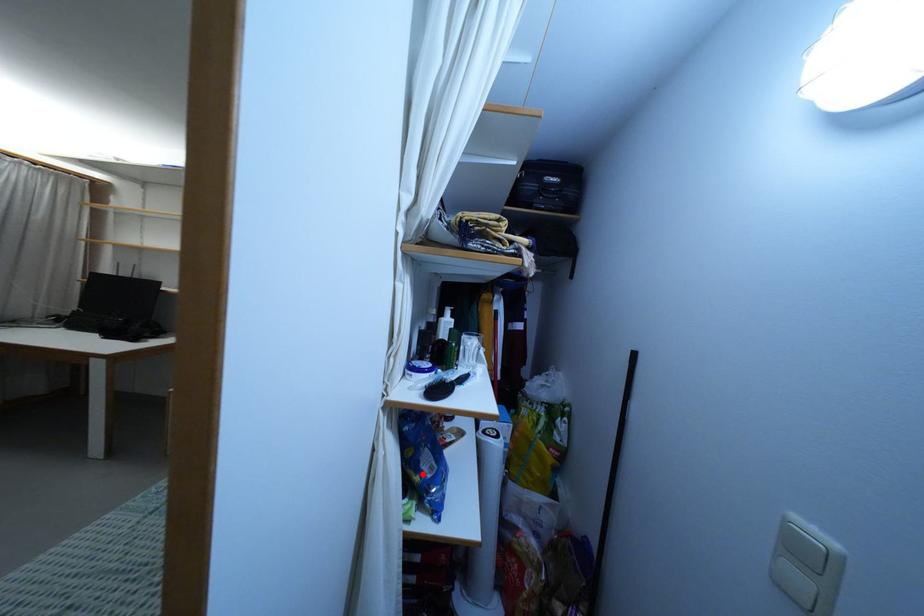
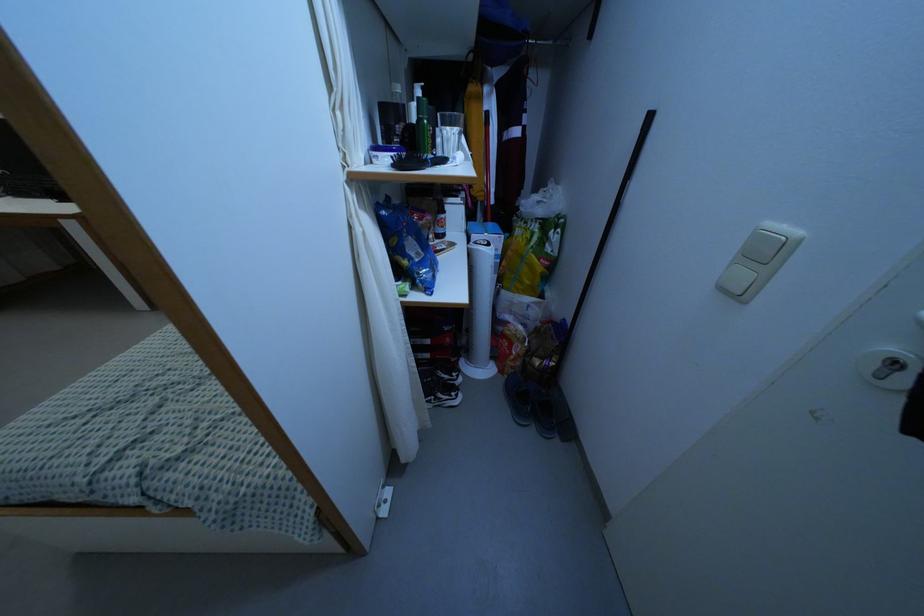
Question: I am providing you with two images of the same scene from different viewpoints. A red point is shown in image1. For the corresponding object point in image2, is it positioned nearer or farther from the camera?

Choices:
 (A) Nearer
 (B) Farther

Answer: (A)